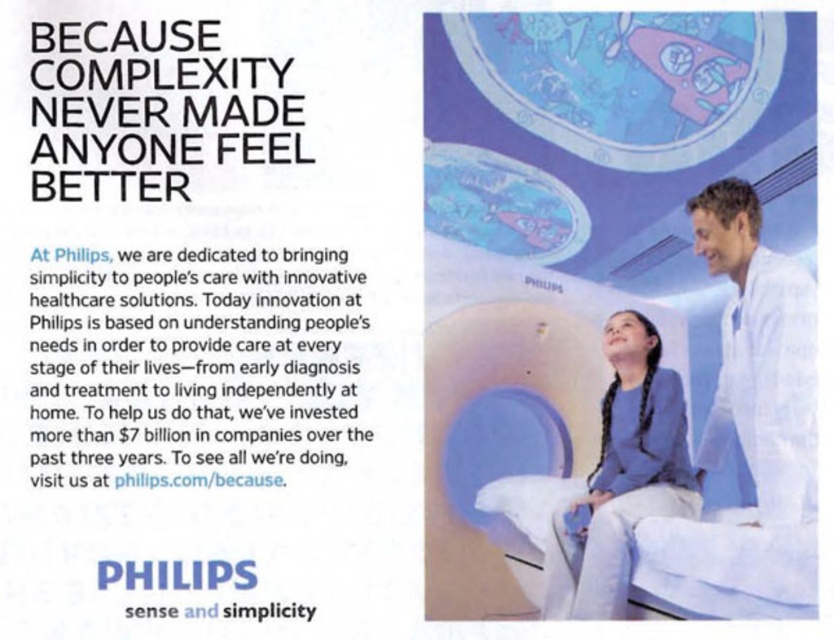
Is blue fabric at center taller than white fabric hospital bed at lower right?

Yes.

Which is above, blue fabric at center or white fabric hospital bed at lower right?

blue fabric at center is above.

Does point (652, 340) come closer to viewer compared to point (805, 556)?

No, it is behind (805, 556).

Locate an element on the screen. blue fabric at center is located at coordinates (631, 465).